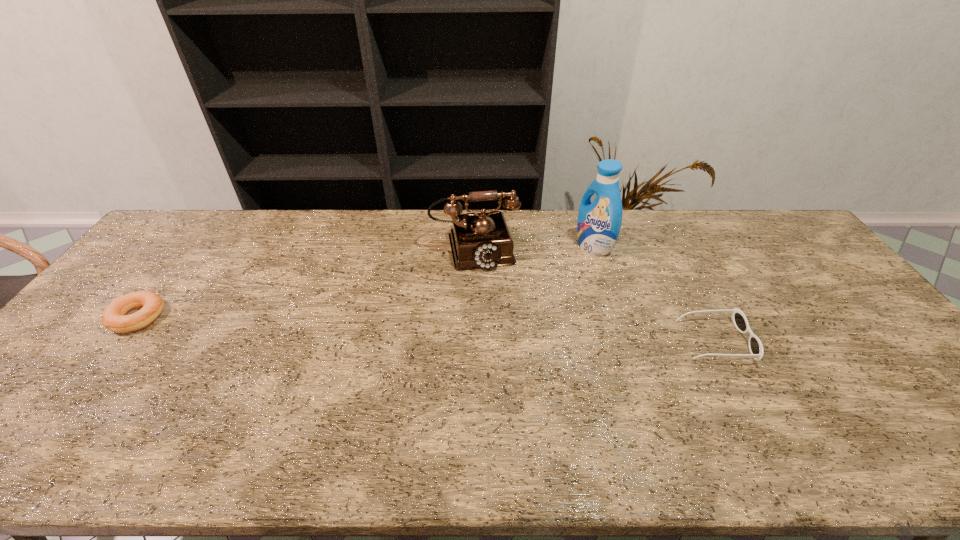
Identify the location of empty space that is in between the bagel and the third object from right to left. (306, 282).

At what (x,y) coordinates should I click in order to perform the action: click on object that is the third nearest to the second object from left to right. Please return your answer as a coordinate pair (x, y). Looking at the image, I should click on (114, 317).

Identify which object is the second nearest to the third object from left to right. Please provide its 2D coordinates. Your answer should be formatted as a tuple, i.e. [(x, y)], where the tuple contains the x and y coordinates of a point satisfying the conditions above.

[(739, 319)]

Find the location of a particular element. The height and width of the screenshot is (540, 960). free point that satisfies the following two spatial constraints: 1. on the back side of the third object from left to right; 2. on the right side of the leftmost object is located at coordinates (193, 247).